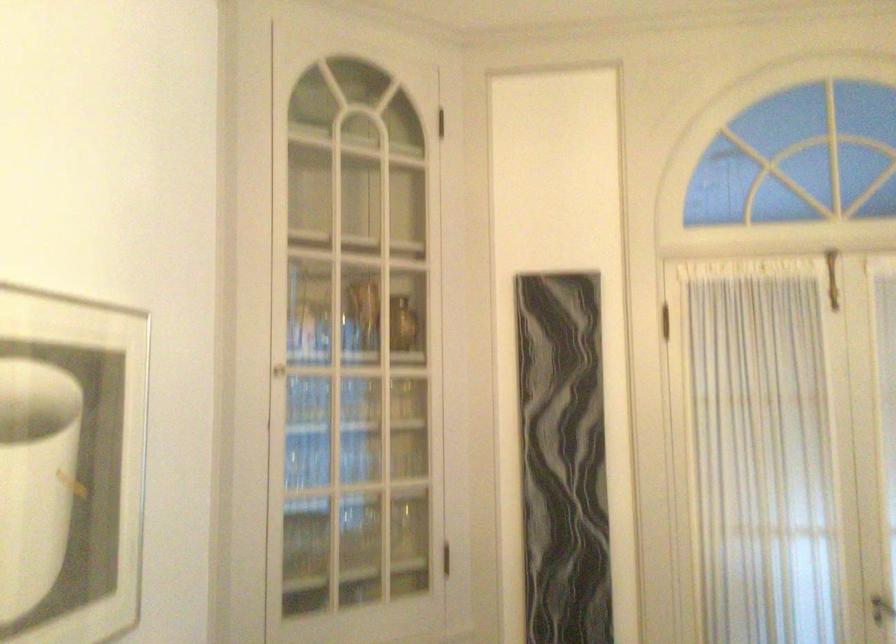
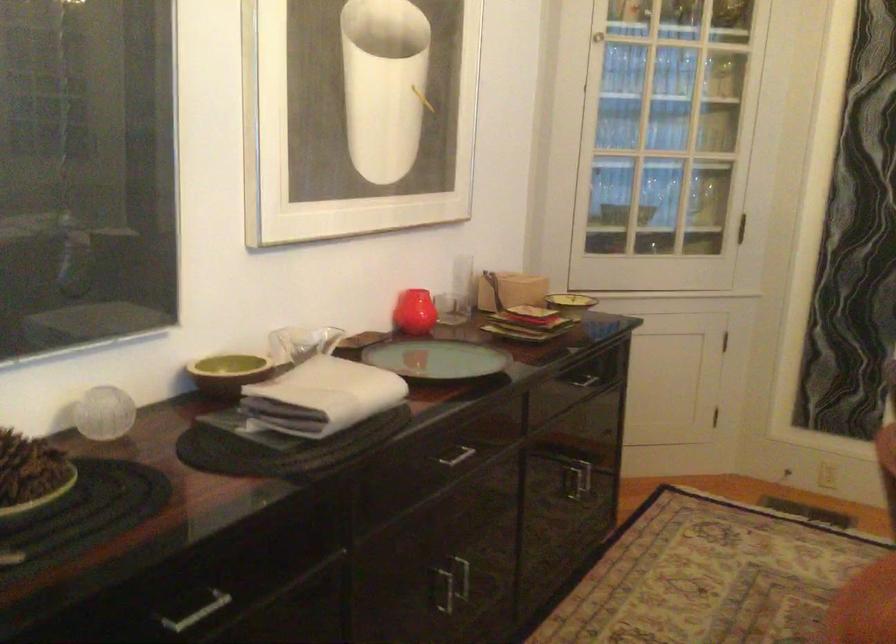
In the second image, find the point that corresponds to pixel 403 399 in the first image.

(721, 77)